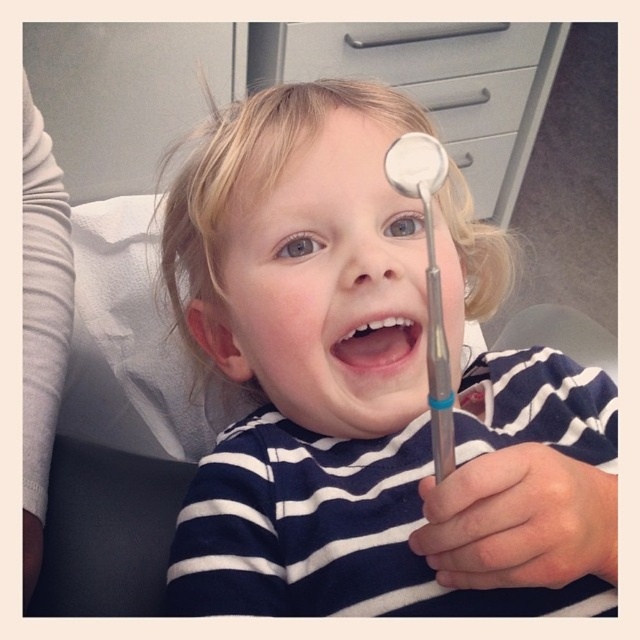
Can you confirm if metallic silver mirror at upper center is shorter than pink glossy lips at center?

No.

Consider the image. Measure the distance between metallic silver mirror at upper center and pink glossy lips at center.

metallic silver mirror at upper center is 2.79 inches away from pink glossy lips at center.

Between point (412, 145) and point (356, 371), which one is positioned in front?

Point (412, 145) is in front.

Find the location of a particular element. metallic silver mirror at upper center is located at coordinates (428, 280).

Does matte silver dental mirror at center appear on the left side of metallic silver mirror at upper center?

Yes, matte silver dental mirror at center is to the left of metallic silver mirror at upper center.

Is point (314, 236) positioned behind point (426, 144)?

Yes.

Identify the location of matte silver dental mirror at center. This screenshot has width=640, height=640. (349, 372).

Can you confirm if matte silver dental mirror at center is positioned above pink glossy lips at center?

No.

Is matte silver dental mirror at center to the left of pink glossy lips at center from the viewer's perspective?

No, matte silver dental mirror at center is not to the left of pink glossy lips at center.

Between point (253, 120) and point (362, 369), which one is positioned behind?

The point (253, 120) is more distant.

At what (x,y) coordinates should I click in order to perform the action: click on matte silver dental mirror at center. Please return your answer as a coordinate pair (x, y). Looking at the image, I should click on (349, 372).